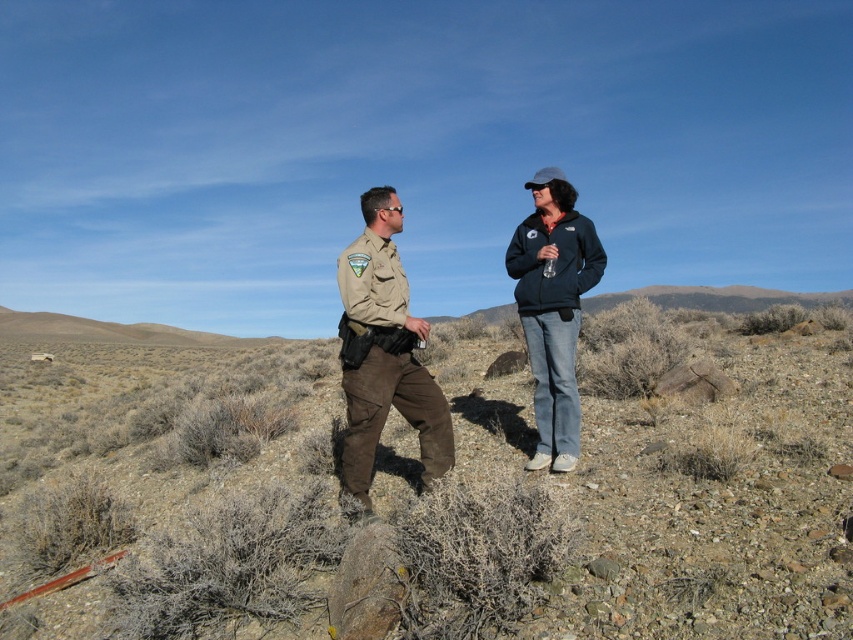
Question: Where is tan uniform at center located in relation to dark blue fleece jacket at center in the image?

Choices:
 (A) right
 (B) left

Answer: (B)

Question: Which point is closer to the camera?

Choices:
 (A) (444, 380)
 (B) (561, 332)

Answer: (B)

Question: Which of the following is the closest to the observer?

Choices:
 (A) brown dirt at center
 (B) dark blue fleece jacket at center
 (C) tan uniform at center

Answer: (A)

Question: Is brown dirt at center smaller than tan uniform at center?

Choices:
 (A) no
 (B) yes

Answer: (A)

Question: Which object appears closest to the camera in this image?

Choices:
 (A) tan uniform at center
 (B) dark blue fleece jacket at center
 (C) brown dirt at center

Answer: (C)

Question: From the image, what is the correct spatial relationship of brown dirt at center in relation to dark blue fleece jacket at center?

Choices:
 (A) right
 (B) left

Answer: (B)